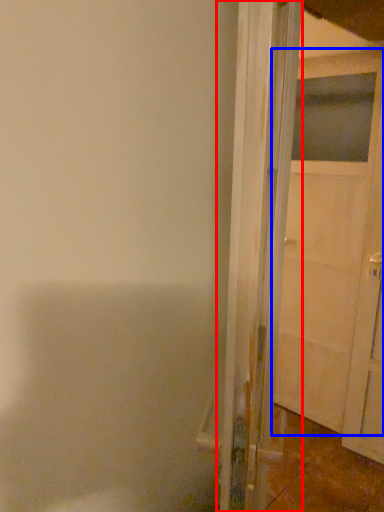
Question: Which object is further to the camera taking this photo, door (highlighted by a red box) or door (highlighted by a blue box)?

Choices:
 (A) door
 (B) door

Answer: (B)